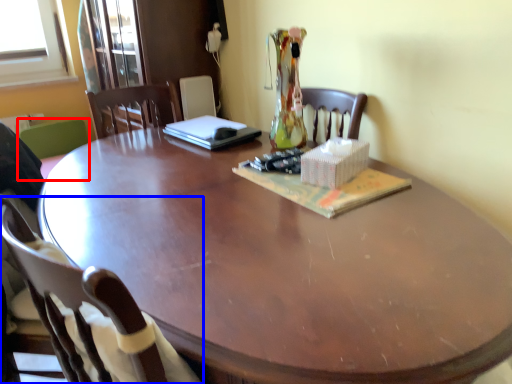
Question: Which object is further to the camera taking this photo, chair (highlighted by a red box) or chair (highlighted by a blue box)?

Choices:
 (A) chair
 (B) chair

Answer: (A)